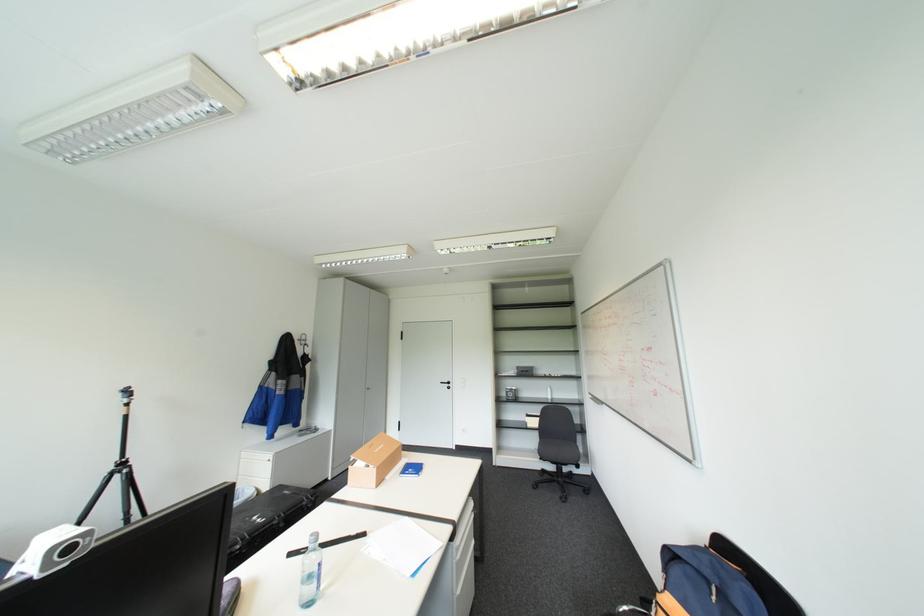
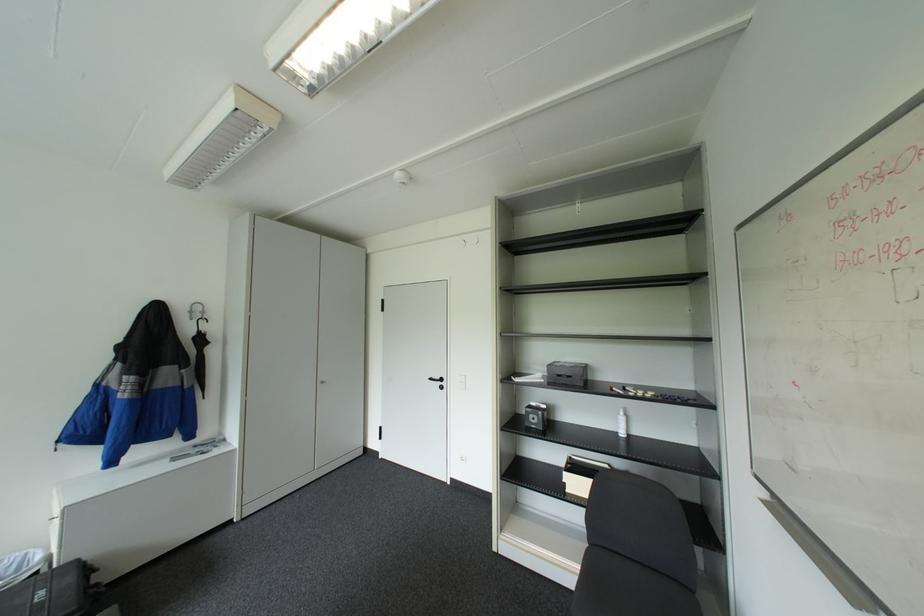
Where in the second image is the point corresponding to (523,373) from the first image?

(551, 379)